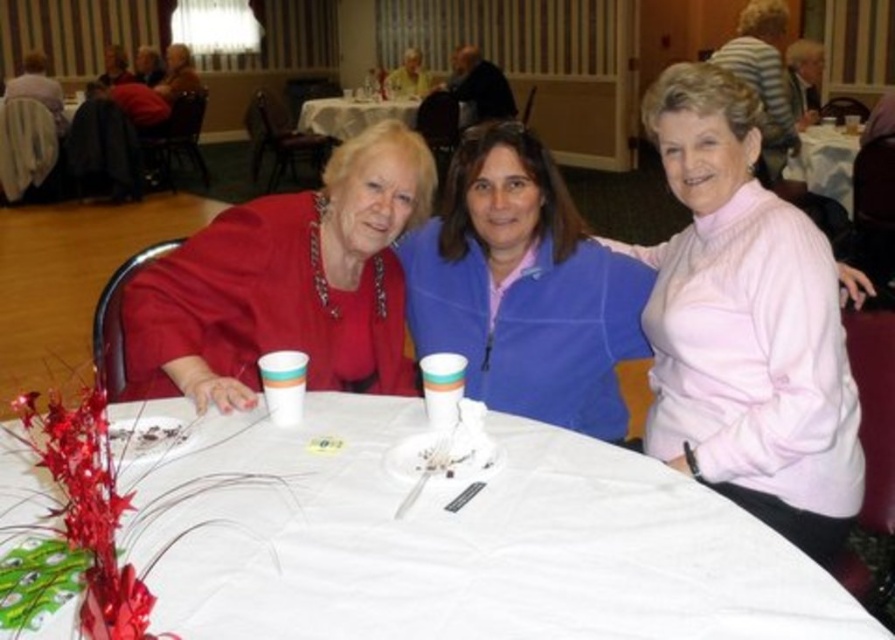
Question: Estimate the real-world distances between objects in this image. Which object is farther from the white paper plate at upper center?

Choices:
 (A) white paper cup at center
 (B) white fabric tablecloth at center
 (C) pink turtleneck sweater at upper right

Answer: (B)

Question: Which object is positioned farthest from the white paper plate at upper center?

Choices:
 (A) white paper cup at center
 (B) matte red dress at center

Answer: (A)

Question: Observing the image, what is the correct spatial positioning of matte red dress at center in reference to pink fleece jacket at center?

Choices:
 (A) above
 (B) below

Answer: (A)

Question: Does white fabric tablecloth at center appear under matte yellow shirt at upper center?

Choices:
 (A) no
 (B) yes

Answer: (B)

Question: Which point is farther to the camera?

Choices:
 (A) (388, 80)
 (B) (808, 189)
 (C) (463, 138)
 (D) (833, 552)

Answer: (A)

Question: Is pink turtleneck sweater at upper right positioned behind pink fleece jacket at center?

Choices:
 (A) yes
 (B) no

Answer: (B)